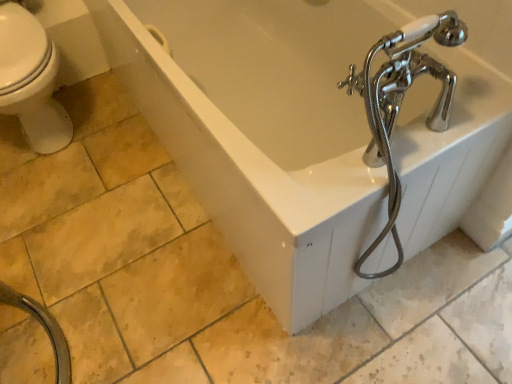
What are the coordinates of `unoccupied area behind black rubber garden hose at lower left` in the screenshot? It's located at click(75, 252).